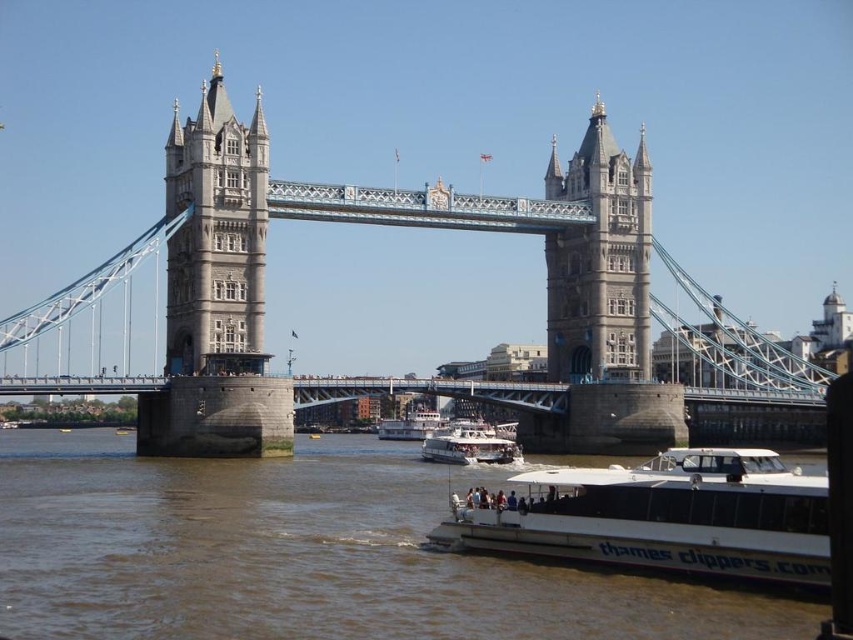
Can you confirm if white stone tower at upper left is wider than gray stone tower at center?

Yes.

Is white stone tower at upper left to the right of gray stone tower at center from the viewer's perspective?

No, white stone tower at upper left is not to the right of gray stone tower at center.

Which is behind, point (260, 285) or point (614, 262)?

The point (614, 262) is more distant.

Identify the location of white stone tower at upper left. (215, 232).

Who is more forward, (415, 506) or (480, 426)?

Point (415, 506)

Is brown water at lower center thinner than white matte boat at center?

No, brown water at lower center is not thinner than white matte boat at center.

This screenshot has height=640, width=853. I want to click on brown water at lower center, so click(300, 556).

Is white matte boat at lower right above gray stone tower at center?

No, white matte boat at lower right is not above gray stone tower at center.

Between point (625, 509) and point (639, 211), which one is positioned in front?

Positioned in front is point (625, 509).

Between point (485, 500) and point (612, 300), which one is positioned in front?

Point (485, 500)

Locate an element on the screen. Image resolution: width=853 pixels, height=640 pixels. white matte boat at lower right is located at coordinates (660, 516).